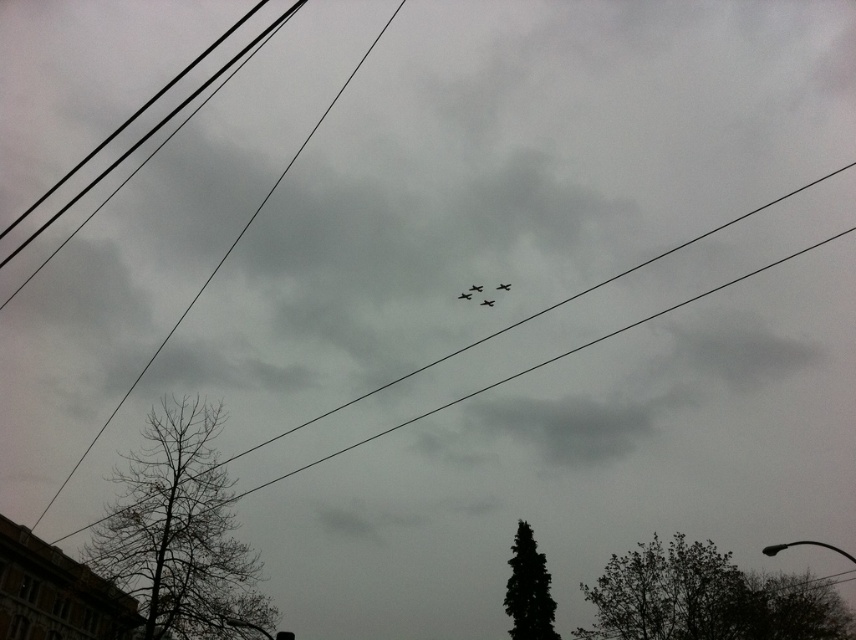
Question: Can you confirm if metallic silver plane at center is positioned above metallic silver airplane at center?

Choices:
 (A) no
 (B) yes

Answer: (B)

Question: Estimate the real-world distances between objects in this image. Which object is closer to the shiny metallic plane at center?

Choices:
 (A) black wire at upper center
 (B) metallic silver plane at center
 (C) metallic gray airplane at center
 (D) green leafy tree at lower right

Answer: (C)

Question: Which point is closer to the camera?

Choices:
 (A) metallic gray airplane at center
 (B) metallic silver plane at center

Answer: (B)

Question: Which object is positioned farthest from the black wire at upper center?

Choices:
 (A) metallic silver plane at center
 (B) green leafy tree at lower right

Answer: (A)

Question: Is metallic silver airplane at center positioned behind metallic gray airplane at center?

Choices:
 (A) no
 (B) yes

Answer: (A)

Question: Is green leafy tree at lower right behind metallic gray airplane at center?

Choices:
 (A) no
 (B) yes

Answer: (A)